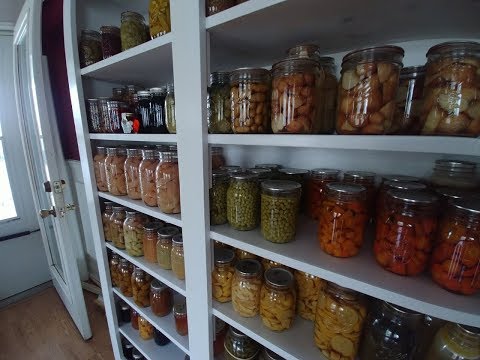
The image size is (480, 360). What are the coordinates of `10 jars` in the screenshot? It's located at (150, 125).